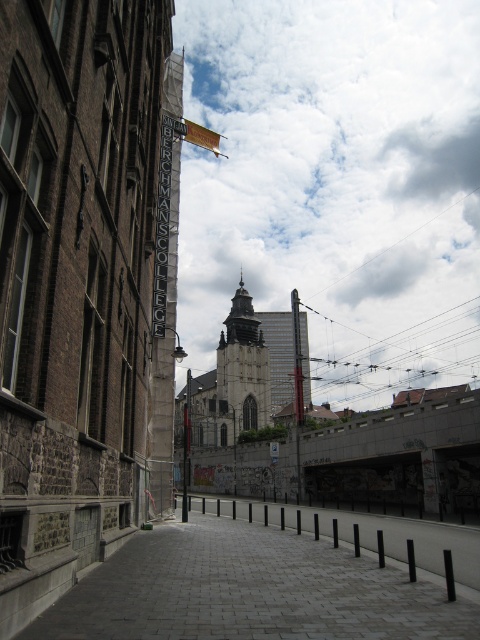
Question: Is the position of cloudy sky at upper center less distant than that of silver metallic sign at center?

Choices:
 (A) yes
 (B) no

Answer: (B)

Question: Which point is closer to the camera taking this photo?

Choices:
 (A) (257, 376)
 (B) (323, 611)
 (C) (168, 314)
 (D) (335, 369)

Answer: (B)

Question: Which point is closer to the camera?

Choices:
 (A) (x=176, y=236)
 (B) (x=181, y=164)

Answer: (A)

Question: Which object is farther from the camera taking this photo?

Choices:
 (A) gray cobblestone pavement at center
 (B) stone gothic church steeple at center
 (C) cloudy sky at upper center

Answer: (B)

Question: Does cloudy sky at upper center appear under silver metallic sign at center?

Choices:
 (A) no
 (B) yes

Answer: (A)

Question: Does silver metallic sign at center have a smaller size compared to stone gothic church steeple at center?

Choices:
 (A) no
 (B) yes

Answer: (B)